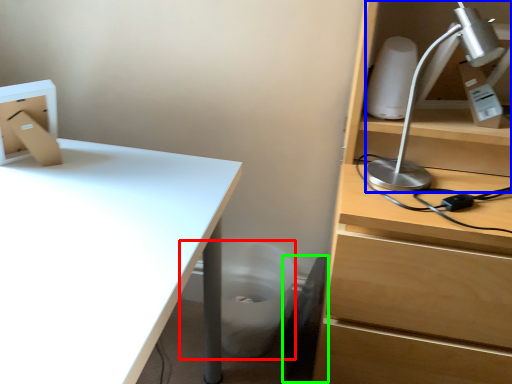
Question: Which object is positioned closest to trash bin/can (highlighted by a red box)? Select from lamp (highlighted by a blue box) and swivel chair (highlighted by a green box).

Choices:
 (A) lamp
 (B) swivel chair

Answer: (B)